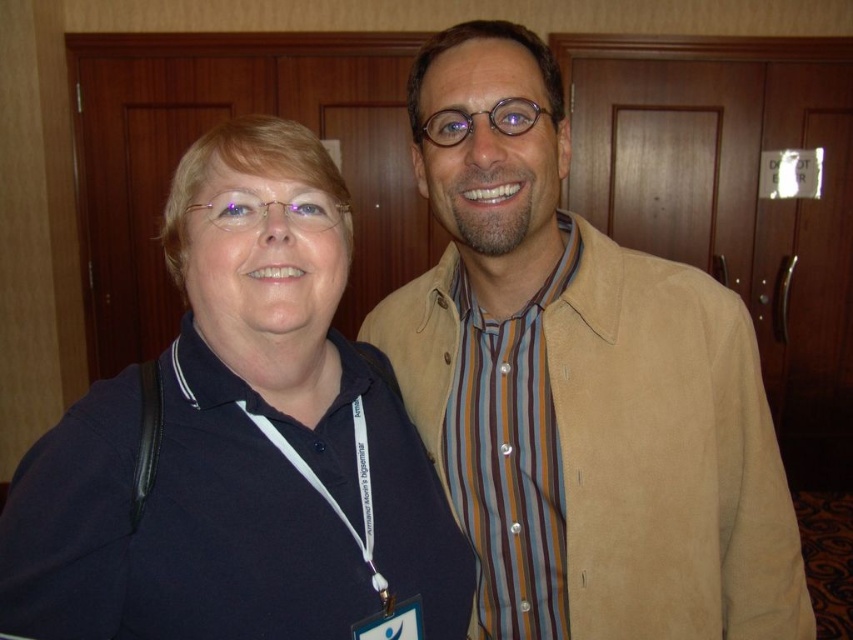
You are a photographer at an event and need to ensure both the matte black polo shirt at left and the striped fabric shirt at right are visible in a tight crop. Given their sizes, which shirt will require more space horizontally in the frame?

The matte black polo shirt at left requires more horizontal space in the frame because its width is larger than the striped fabric shirt at right.

You are a photographer at a conference and need to ensure that the suede jacket at center and the striped fabric shirt at right are clearly visible in the photo. Given that your camera has a depth of field that can focus on objects within 2.5 inches of each other, will both items remain in focus?

The suede jacket at center is 3.03 inches away from the striped fabric shirt at right, which exceeds the camera depth of field range of 2.5 inches. Therefore, both items may not remain in focus simultaneously.

You are standing in front of the two people in the image and want to place a small sticker on the point closer to you between point (316, 396) and point (527, 422). Which point should you choose?

You should choose point (316, 396) because it is closer to the viewer than point (527, 422).